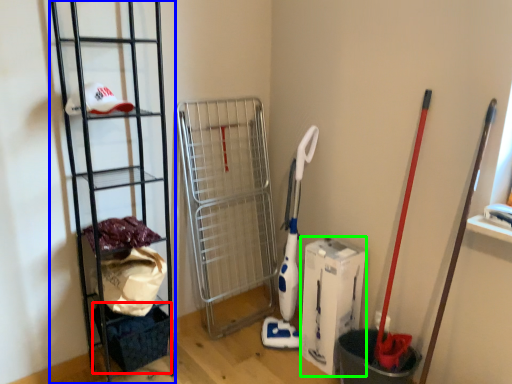
Question: Which object is the closest to the basket (highlighted by a red box)? Choose among these: ladder (highlighted by a blue box) or box (highlighted by a green box).

Choices:
 (A) ladder
 (B) box

Answer: (A)